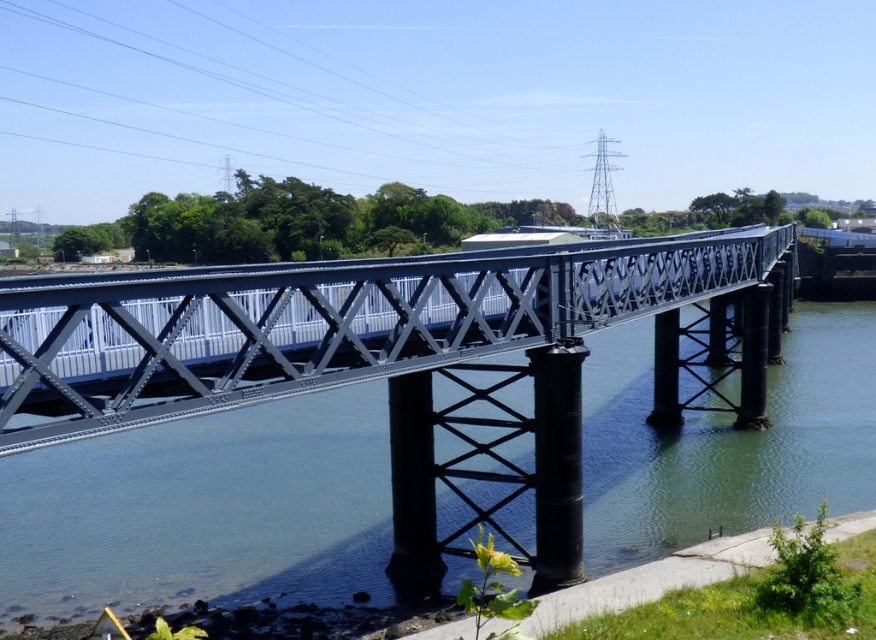
Which is behind, point (260, 461) or point (739, 250)?

Positioned behind is point (739, 250).

Does greenish-blue water at center have a greater height compared to metallic bridge at center?

No.

Who is more forward, (107, 595) or (174, 387)?

Point (174, 387) is more forward.

The width and height of the screenshot is (876, 640). In order to click on greenish-blue water at center in this screenshot , I will do `click(203, 509)`.